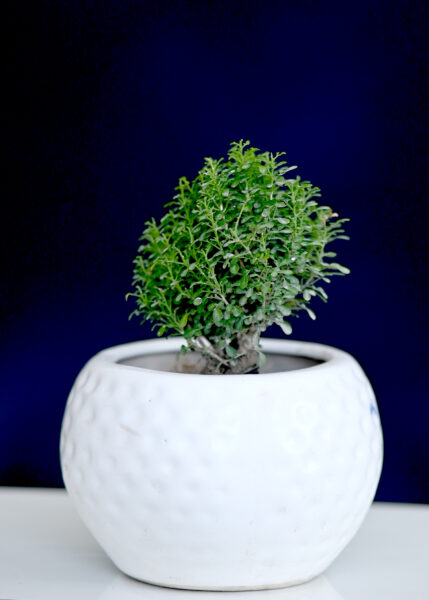
You are a GUI agent. You are given a task and a screenshot of the screen. Output one action in this format:
    pyautogui.click(x=<x>, y=<y>)
    Task: Click on the table
    The height and width of the screenshot is (600, 429).
    Given the screenshot: What is the action you would take?
    pyautogui.click(x=58, y=529)